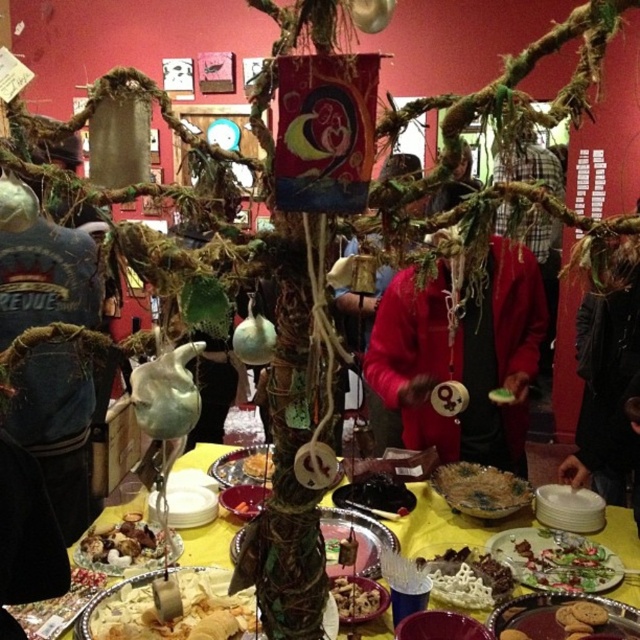
Question: Which point appears farthest from the camera in this image?

Choices:
 (A) (596, 385)
 (B) (456, 563)
 (C) (54, 449)
 (D) (378, 499)

Answer: (C)

Question: Which of these objects is positioned closest to the dark chocolate cake at center?

Choices:
 (A) brown crumbly cookie at center bottom
 (B) green leafy vegetable at center
 (C) shiny silver spoon at center
 (D) smooth orange carrot at center

Answer: (A)

Question: Does green leafy salad plate at center have a larger size compared to black glossy chocolate at center?

Choices:
 (A) no
 (B) yes

Answer: (B)

Question: Which of the following is the closest to the observer?

Choices:
 (A) yellow matte cake at center
 (B) shiny silver spoon at center
 (C) golden crumbly pastry at center
 (D) brushed metal jacket at left

Answer: (C)

Question: Where is golden crumbly pastry at center located in relation to brown crumbly cookie at center bottom in the image?

Choices:
 (A) above
 (B) below

Answer: (A)

Question: Can you confirm if wooden table at center is positioned above golden crumbly pastry at center?

Choices:
 (A) no
 (B) yes

Answer: (B)